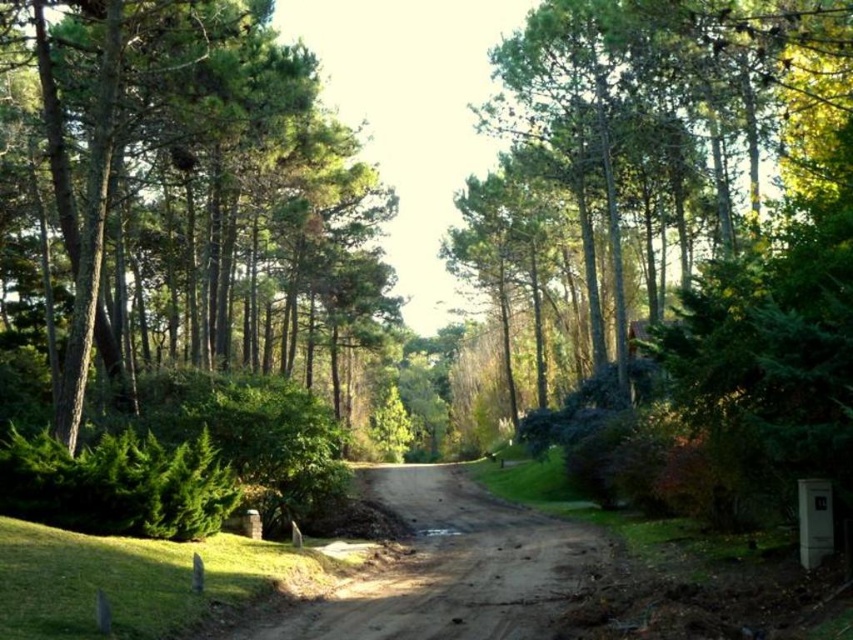
Question: Which of these objects is positioned closest to the green leafy tree at center?

Choices:
 (A) green leafy tree at left
 (B) brown dirt track at center

Answer: (A)

Question: Does green leafy tree at center appear over brown dirt track at center?

Choices:
 (A) no
 (B) yes

Answer: (B)

Question: Which of these objects is positioned farthest from the green leafy tree at center?

Choices:
 (A) green leafy tree at left
 (B) brown dirt track at center

Answer: (B)

Question: Does green leafy tree at center have a larger size compared to brown dirt track at center?

Choices:
 (A) yes
 (B) no

Answer: (A)

Question: Does green leafy tree at center appear under brown dirt track at center?

Choices:
 (A) no
 (B) yes

Answer: (A)

Question: Which point is closer to the camera?

Choices:
 (A) brown dirt track at center
 (B) green leafy tree at left
 (C) green leafy tree at center

Answer: (A)